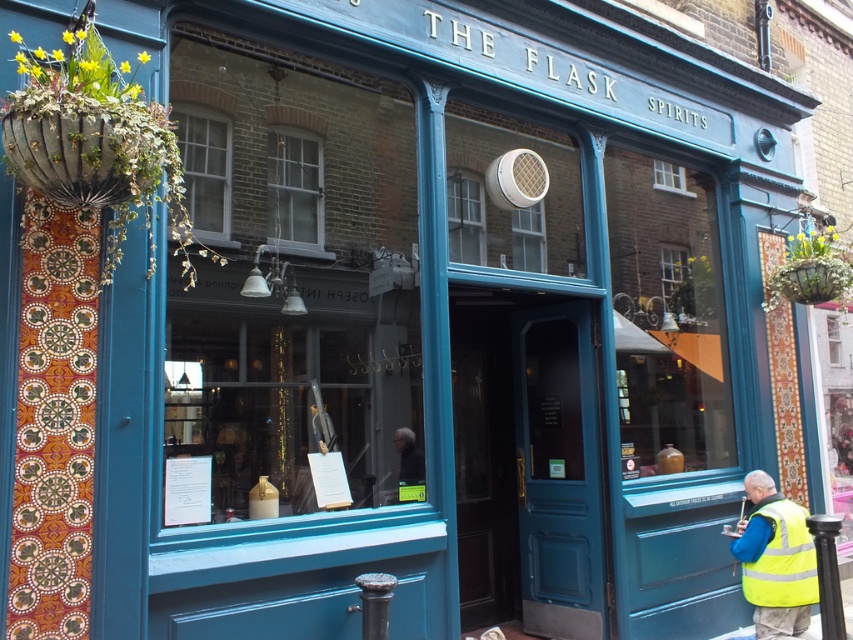
Between point (769, 592) and point (399, 451), which one is positioned behind?

The point (769, 592) is behind.

Is point (810, 588) farther from camera compared to point (404, 433)?

Yes, it is behind point (404, 433).

Where is `yellow reflective safety vest at lower right`? yellow reflective safety vest at lower right is located at coordinates (782, 557).